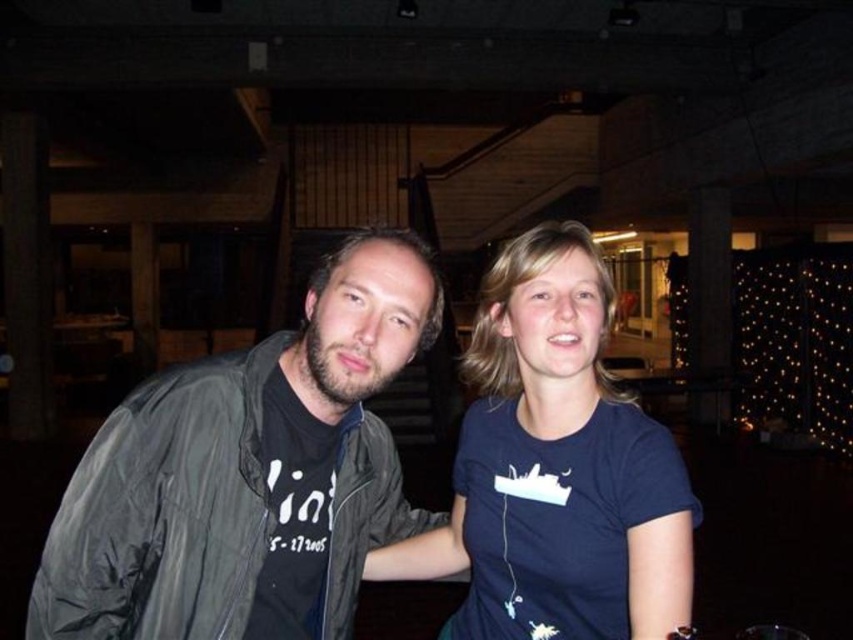
Based on the coordinates provided, which object is located at point (248, 474) in the image?

The point (248, 474) indicates the location of the dark gray jacket at center.